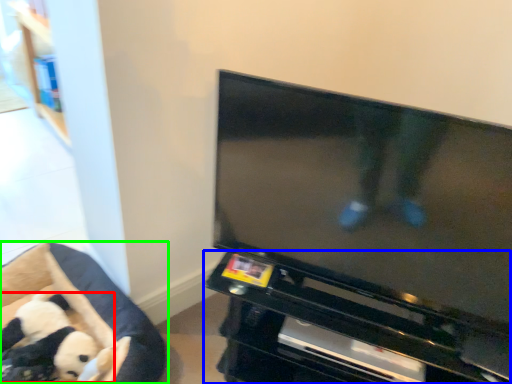
Question: Based on their relative distances, which object is farther from toy (highlighted by a red box)? Choose from entertainment center (highlighted by a blue box) and furniture (highlighted by a green box).

Choices:
 (A) entertainment center
 (B) furniture

Answer: (A)